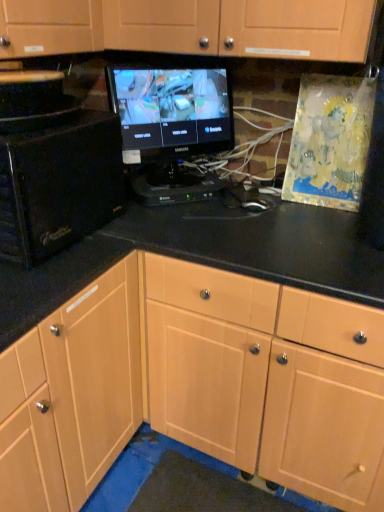
Question: Are light wood cabinet at center and black glossy microwave at left beside each other?

Choices:
 (A) yes
 (B) no

Answer: (B)

Question: From a real-world perspective, is light wood cabinet at center located beneath black glossy microwave at left?

Choices:
 (A) yes
 (B) no

Answer: (A)

Question: Is light wood cabinet at center to the right of black glossy microwave at left from the viewer's perspective?

Choices:
 (A) no
 (B) yes

Answer: (B)

Question: Considering the relative sizes of light wood cabinet at center and black glossy microwave at left in the image provided, is light wood cabinet at center wider than black glossy microwave at left?

Choices:
 (A) no
 (B) yes

Answer: (B)

Question: From the image's perspective, does light wood cabinet at center appear lower than black glossy microwave at left?

Choices:
 (A) no
 (B) yes

Answer: (B)

Question: From a real-world perspective, is black glossy microwave at left above or below black glossy monitor at center?

Choices:
 (A) below
 (B) above

Answer: (A)

Question: Based on their sizes in the image, would you say black glossy microwave at left is bigger or smaller than black glossy monitor at center?

Choices:
 (A) small
 (B) big

Answer: (B)

Question: Choose the correct answer: Is black glossy microwave at left inside black glossy monitor at center or outside it?

Choices:
 (A) outside
 (B) inside

Answer: (A)

Question: From their relative heights in the image, would you say black glossy microwave at left is taller or shorter than black glossy monitor at center?

Choices:
 (A) tall
 (B) short

Answer: (B)

Question: Based on their sizes in the image, would you say black glossy microwave at left is bigger or smaller than light wood cabinet at center?

Choices:
 (A) small
 (B) big

Answer: (A)

Question: Based on their positions, is black glossy microwave at left located to the left or right of light wood cabinet at center?

Choices:
 (A) right
 (B) left

Answer: (B)

Question: In terms of height, does black glossy microwave at left look taller or shorter compared to light wood cabinet at center?

Choices:
 (A) short
 (B) tall

Answer: (A)

Question: Is point (117, 150) closer or farther from the camera than point (178, 306)?

Choices:
 (A) farther
 (B) closer

Answer: (B)

Question: In the image, is black glossy monitor at center on the left side or the right side of light wood cabinet at center?

Choices:
 (A) right
 (B) left

Answer: (B)

Question: Is black glossy monitor at center bigger or smaller than light wood cabinet at center?

Choices:
 (A) big
 (B) small

Answer: (B)